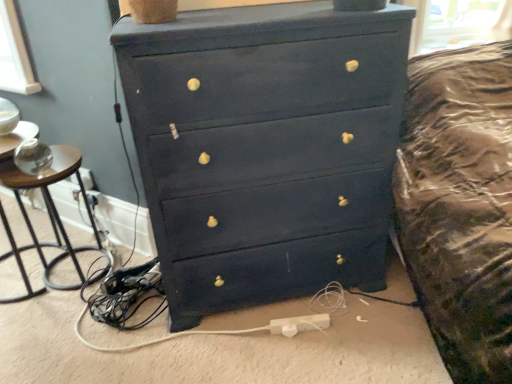
This screenshot has width=512, height=384. What do you see at coordinates (298, 324) in the screenshot?
I see `white plastic extension cord at lower center` at bounding box center [298, 324].

What are the coordinates of `matte black dresser at center` in the screenshot? It's located at (265, 148).

Is the surface of matte black dresser at center in direct contact with white plastic extension cord at lower center?

No.

Consider the image. Considering the relative positions of matte black dresser at center and white plastic extension cord at lower center in the image provided, is matte black dresser at center to the left of white plastic extension cord at lower center from the viewer's perspective?

Correct, you'll find matte black dresser at center to the left of white plastic extension cord at lower center.

Looking at this image, which is closer to the camera, (174,306) or (278,334)?

Point (174,306).

Would you say white plastic extension cord at lower center is to the left or to the right of matte black dresser at center in the picture?

Based on their positions, white plastic extension cord at lower center is located to the right of matte black dresser at center.

Find the location of a particular element. This screenshot has width=512, height=384. the chest of drawers above the white plastic extension cord at lower center (from a real-world perspective) is located at coordinates (265, 148).

Which is correct: white plastic extension cord at lower center is inside matte black dresser at center, or outside of it?

white plastic extension cord at lower center is spatially situated outside matte black dresser at center.

Does point (305, 327) come farther from viewer compared to point (301, 96)?

Yes.

Locate an element on the screen. The height and width of the screenshot is (384, 512). chest of drawers in front of the brown wood side table at left is located at coordinates (265, 148).

Considering the relative positions of brown wood side table at left and matte black dresser at center in the image provided, is brown wood side table at left to the left or to the right of matte black dresser at center?

brown wood side table at left is to the left of matte black dresser at center.

Is point (30, 233) closer or farther from the camera than point (179, 63)?

Point (30, 233).

Is brown wood side table at left thinner than matte black dresser at center?

Indeed, brown wood side table at left has a lesser width compared to matte black dresser at center.

Is matte black dresser at center smaller than brown wood side table at left?

No.

From the image's perspective, which object appears higher, matte black dresser at center or brown wood side table at left?

From the image's view, matte black dresser at center is above.

Considering the positions of point (162, 42) and point (25, 248), is point (162, 42) closer or farther from the camera than point (25, 248)?

Point (162, 42) appears to be closer to the viewer than point (25, 248).

Considering the relative positions of brown wood side table at left and white plastic extension cord at lower center in the image provided, is brown wood side table at left in front of white plastic extension cord at lower center?

Yes, brown wood side table at left is in front of white plastic extension cord at lower center.

Where is `side table located above the white plastic extension cord at lower center (from a real-world perspective)`? side table located above the white plastic extension cord at lower center (from a real-world perspective) is located at coordinates (49, 216).

Is brown wood side table at left oriented towards white plastic extension cord at lower center?

No, brown wood side table at left does not turn towards white plastic extension cord at lower center.

Is white plastic extension cord at lower center taller than brown wood side table at left?

In fact, white plastic extension cord at lower center may be shorter than brown wood side table at left.

In the image, there is a brown wood side table at left. Where is `extension cord below it (from the image's perspective)`? extension cord below it (from the image's perspective) is located at coordinates (298, 324).

Measure the distance from white plastic extension cord at lower center to brown wood side table at left.

white plastic extension cord at lower center and brown wood side table at left are 96.76 centimeters apart.

Which object is further away from the camera, white plastic extension cord at lower center or brown wood side table at left?

white plastic extension cord at lower center is further from the camera.

In the image, there is a matte black dresser at center. At what (x,y) coordinates should I click in order to perform the action: click on extension cord below it (from the image's perspective). Please return your answer as a coordinate pair (x, y). The width and height of the screenshot is (512, 384). Looking at the image, I should click on (298, 324).

Find the location of a particular element. The height and width of the screenshot is (384, 512). extension cord on the right side of matte black dresser at center is located at coordinates (298, 324).

Looking at the image, which one is located further to white plastic extension cord at lower center, brown wood side table at left or matte black dresser at center?

brown wood side table at left lies further to white plastic extension cord at lower center than the other object.

When comparing their distances from matte black dresser at center, does brown wood side table at left or white plastic extension cord at lower center seem further?

Based on the image, brown wood side table at left appears to be further to matte black dresser at center.

Looking at the image, which one is located closer to matte black dresser at center, white plastic extension cord at lower center or brown wood side table at left?

Among the two, white plastic extension cord at lower center is located nearer to matte black dresser at center.

Estimate the real-world distances between objects in this image. Which object is further from brown wood side table at left, white plastic extension cord at lower center or matte black dresser at center?

Among the two, white plastic extension cord at lower center is located further to brown wood side table at left.

Looking at the image, which one is located further to white plastic extension cord at lower center, matte black dresser at center or brown wood side table at left?

brown wood side table at left.

Estimate the real-world distances between objects in this image. Which object is further from brown wood side table at left, matte black dresser at center or white plastic extension cord at lower center?

white plastic extension cord at lower center.

Where is `the chest of drawers located between brown wood side table at left and white plastic extension cord at lower center in the left-right direction`? the chest of drawers located between brown wood side table at left and white plastic extension cord at lower center in the left-right direction is located at coordinates (265, 148).